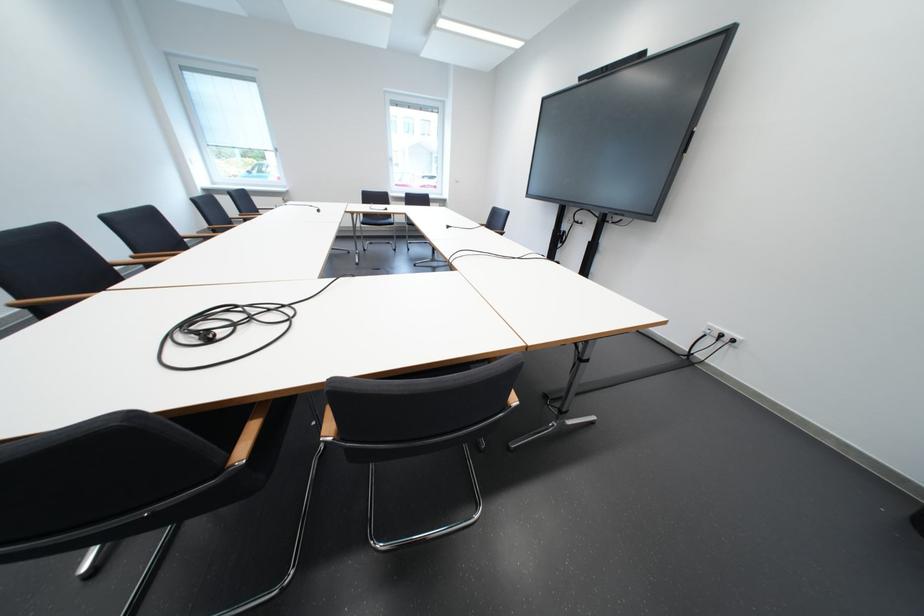
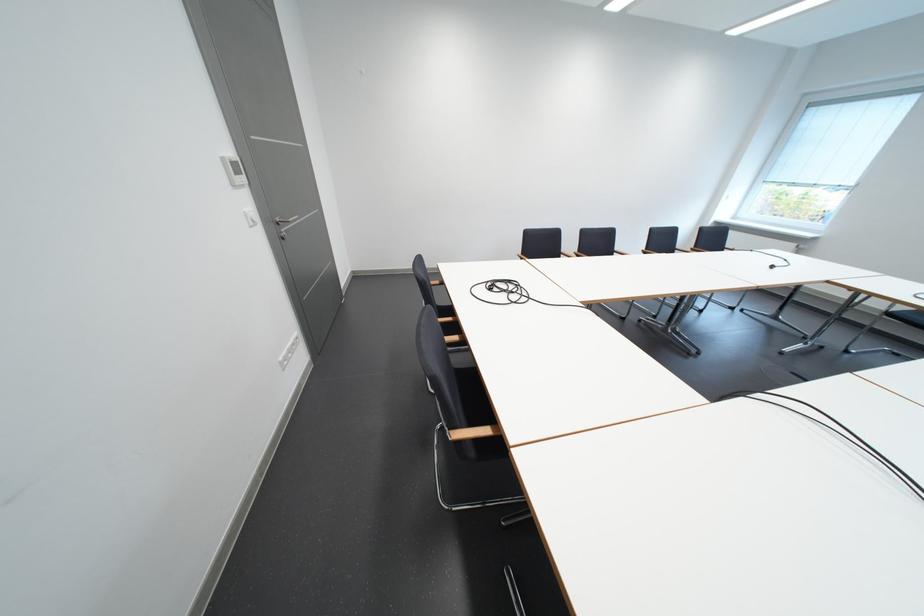
In the scene shown: How did the camera likely rotate?

The camera's rotation is toward left-down.